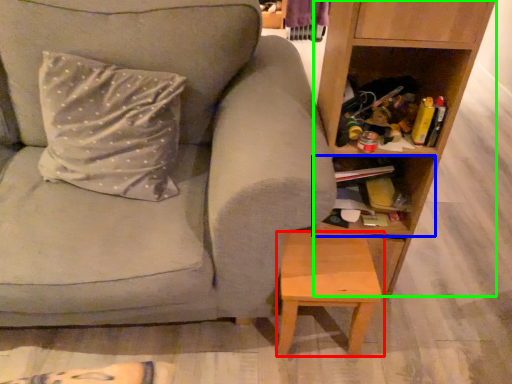
Question: Considering the real-world distances, which object is farthest from stool (highlighted by a red box)? cabinet (highlighted by a blue box) or shelf (highlighted by a green box)?

Choices:
 (A) cabinet
 (B) shelf

Answer: (B)